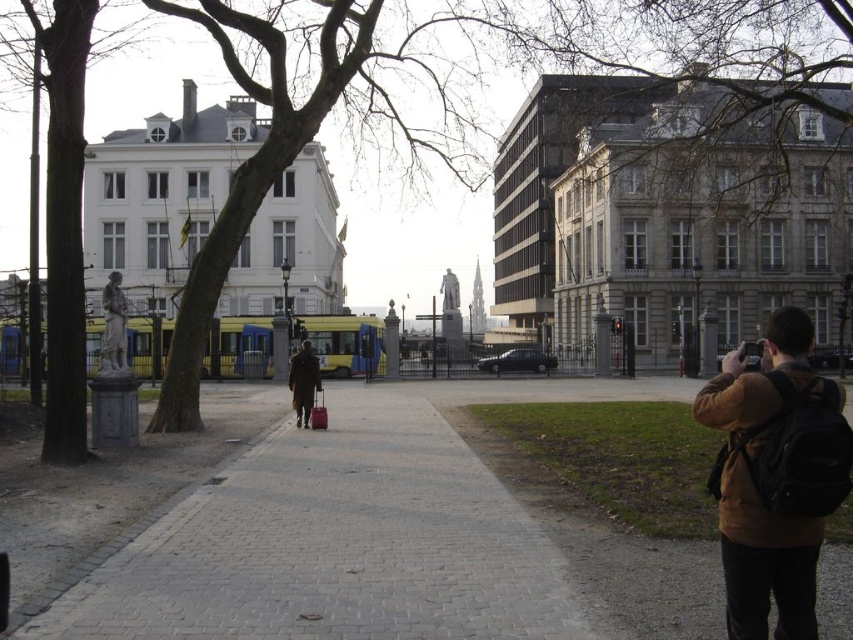
Question: Which point appears farthest from the camera in this image?

Choices:
 (A) (305, 426)
 (B) (749, 579)
 (C) (415, 432)

Answer: (A)

Question: Which point is farther to the camera?

Choices:
 (A) (294, 362)
 (B) (602, 616)

Answer: (A)

Question: Which point is closer to the camera taking this photo?

Choices:
 (A) (300, 378)
 (B) (820, 541)

Answer: (B)

Question: Can you confirm if brown leather jacket at lower right is positioned above brown leather coat at center?

Choices:
 (A) no
 (B) yes

Answer: (B)

Question: Is brown leather jacket at lower right to the right of brown leather coat at center from the viewer's perspective?

Choices:
 (A) no
 (B) yes

Answer: (B)

Question: Where is gray brick pavement at center located in relation to brown leather coat at center in the image?

Choices:
 (A) above
 (B) below

Answer: (B)